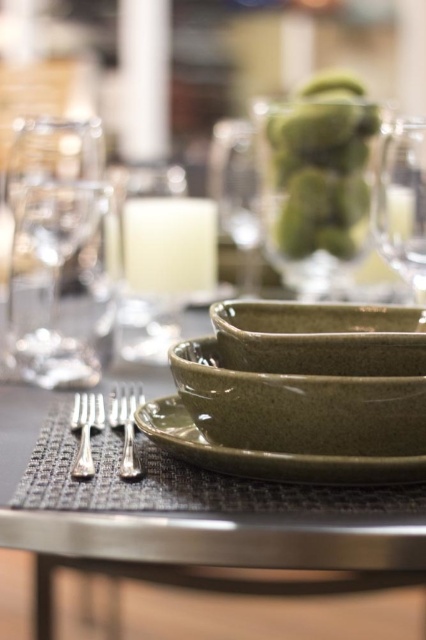
Question: Which point is farther to the camera?

Choices:
 (A) click(77, 392)
 (B) click(238, 221)

Answer: (B)

Question: Which point appears closest to the camera in this image?

Choices:
 (A) (293, 456)
 (B) (308, 387)

Answer: (A)

Question: Can you confirm if green speckled ceramic plates at center is bigger than green speckled plate at center?

Choices:
 (A) no
 (B) yes

Answer: (B)

Question: Which of the following is the closest to the observer?

Choices:
 (A) (386, 317)
 (B) (313, 477)

Answer: (B)

Question: Is green speckled glass at upper center below clear glass wine glass at center?

Choices:
 (A) yes
 (B) no

Answer: (A)

Question: Can you confirm if green stoneware bowl at center is positioned below green speckled plate at center?

Choices:
 (A) yes
 (B) no

Answer: (B)